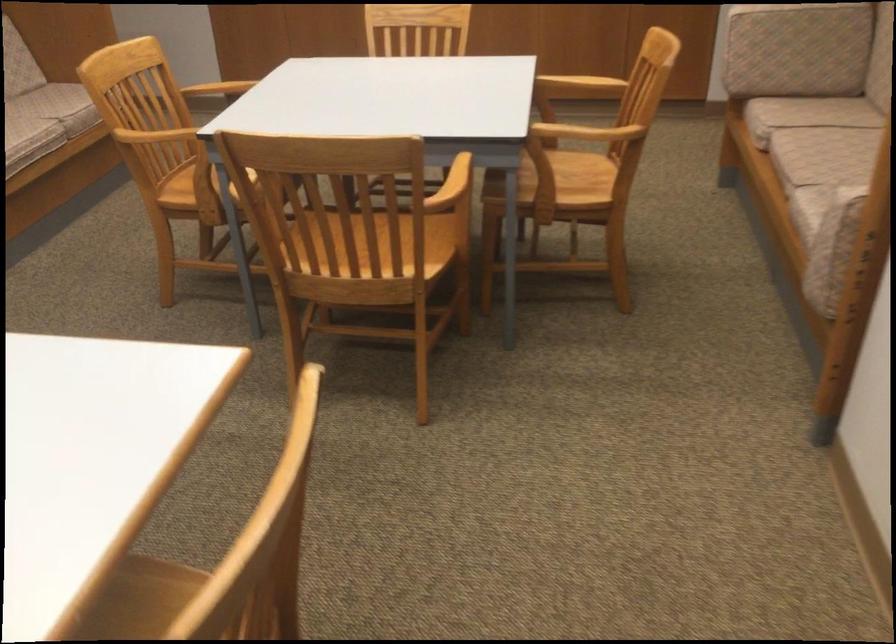
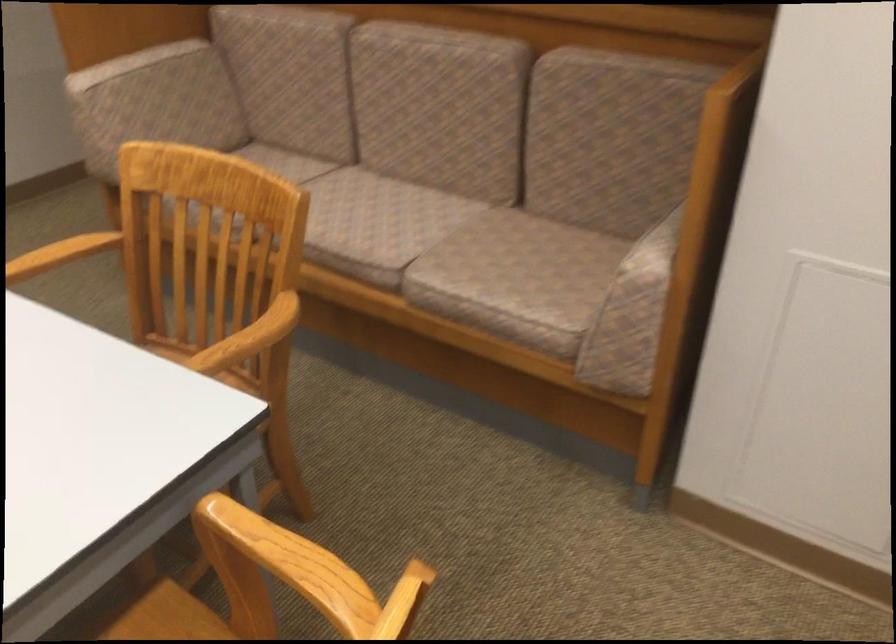
Question: I am providing you with two images of the same scene from different viewpoints. After the viewpoint changes to image2, which objects are now occluded?

Choices:
 (A) silver metal pitcher
 (B) upholstered sofa sitting surface
 (C) chair sitting surface
 (D) upholstered sofa armrest

Answer: (C)